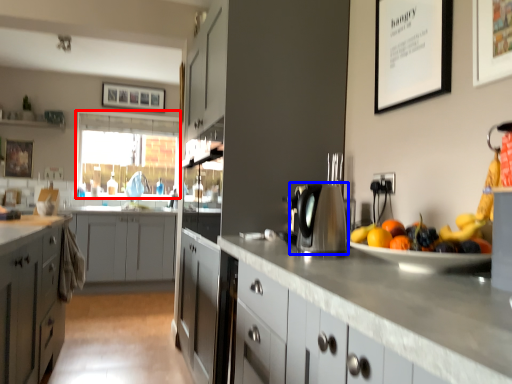
Question: Among these objects, which one is nearest to the camera, window screen (highlighted by a red box) or kitchen appliance (highlighted by a blue box)?

Choices:
 (A) window screen
 (B) kitchen appliance

Answer: (B)